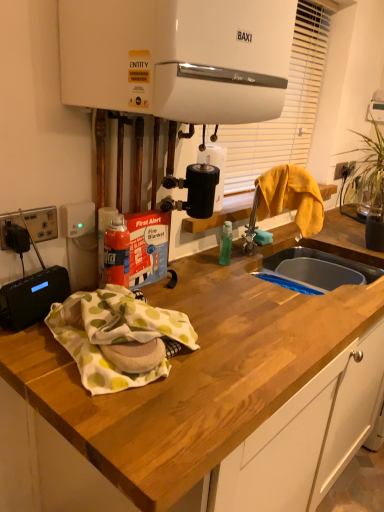
Question: From the image's perspective, is white plastic blind at upper center above yellow fabric at sink?

Choices:
 (A) yes
 (B) no

Answer: (A)

Question: Does white plastic blind at upper center appear on the left side of yellow fabric at sink?

Choices:
 (A) no
 (B) yes

Answer: (B)

Question: Could you tell me if white plastic blind at upper center is turned towards yellow fabric at sink?

Choices:
 (A) yes
 (B) no

Answer: (A)

Question: From a real-world perspective, is white plastic blind at upper center physically above yellow fabric at sink?

Choices:
 (A) no
 (B) yes

Answer: (B)

Question: Is there a large distance between white plastic blind at upper center and yellow fabric at sink?

Choices:
 (A) yes
 (B) no

Answer: (B)

Question: From their relative heights in the image, would you say yellow fabric at sink is taller or shorter than black plastic socket at left?

Choices:
 (A) short
 (B) tall

Answer: (B)

Question: Considering the positions of yellow fabric at sink and black plastic socket at left in the image, is yellow fabric at sink bigger or smaller than black plastic socket at left?

Choices:
 (A) big
 (B) small

Answer: (A)

Question: Considering the positions of point (301, 205) and point (41, 230), is point (301, 205) closer or farther from the camera than point (41, 230)?

Choices:
 (A) closer
 (B) farther

Answer: (B)

Question: From a real-world perspective, is yellow fabric at sink physically located above or below black plastic socket at left?

Choices:
 (A) above
 (B) below

Answer: (A)

Question: From a real-world perspective, is green leafy plant at right positioned above or below white plastic blind at upper center?

Choices:
 (A) above
 (B) below

Answer: (B)

Question: Is green leafy plant at right bigger or smaller than white plastic blind at upper center?

Choices:
 (A) small
 (B) big

Answer: (A)

Question: In the image, is green leafy plant at right on the left side or the right side of white plastic blind at upper center?

Choices:
 (A) left
 (B) right

Answer: (B)

Question: Is green leafy plant at right in front of or behind white plastic blind at upper center in the image?

Choices:
 (A) behind
 (B) front

Answer: (A)

Question: In terms of width, does black plastic socket at left look wider or thinner when compared to green leafy plant at right?

Choices:
 (A) thin
 (B) wide

Answer: (A)

Question: Relative to green leafy plant at right, is black plastic socket at left in front or behind?

Choices:
 (A) front
 (B) behind

Answer: (A)